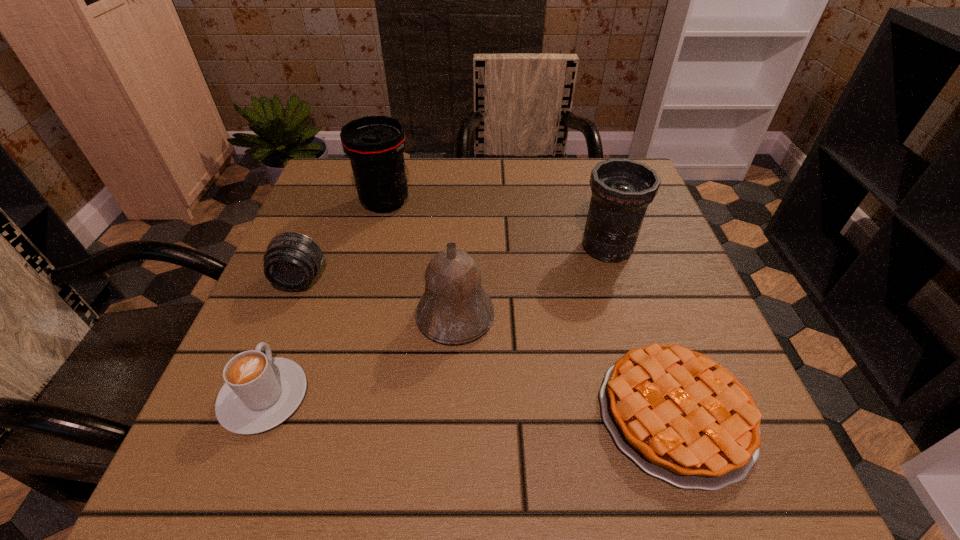
At what (x,y) coordinates should I click in order to perform the action: click on free space at the near left corner. Please return your answer as a coordinate pair (x, y). This screenshot has height=540, width=960. Looking at the image, I should click on (222, 444).

The width and height of the screenshot is (960, 540). Identify the location of vacant region at the far right corner of the desktop. (581, 161).

The width and height of the screenshot is (960, 540). I want to click on free space at the near right corner, so click(750, 476).

Where is `free space between the rightmost telephoto lens and the pie`? The width and height of the screenshot is (960, 540). free space between the rightmost telephoto lens and the pie is located at coordinates (641, 330).

Where is `vacant region between the rightmost telephoto lens and the second telephoto lens from right to left`? The image size is (960, 540). vacant region between the rightmost telephoto lens and the second telephoto lens from right to left is located at coordinates (496, 225).

Where is `free point between the third object from right to left and the cappuccino`? The image size is (960, 540). free point between the third object from right to left and the cappuccino is located at coordinates pyautogui.click(x=360, y=356).

This screenshot has width=960, height=540. I want to click on free spot between the shortest object and the bell, so click(x=565, y=365).

Where is `free area in between the bell and the third shortest object`? This screenshot has height=540, width=960. free area in between the bell and the third shortest object is located at coordinates (378, 298).

Find the location of `vacant area that lies between the farthest telephoto lens and the cappuccino`. vacant area that lies between the farthest telephoto lens and the cappuccino is located at coordinates (324, 300).

Locate an element on the screen. Image resolution: width=960 pixels, height=540 pixels. empty space between the farthest telephoto lens and the rightmost telephoto lens is located at coordinates (496, 225).